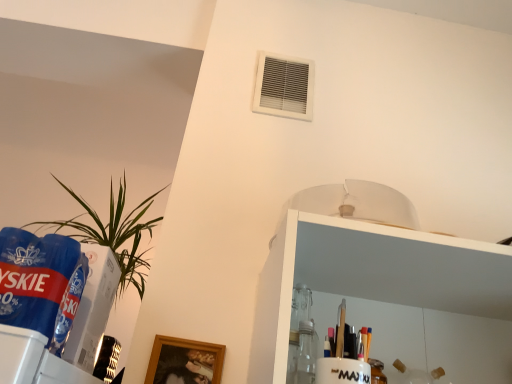
What is the approximate width of white plastic air conditioning at upper center?

white plastic air conditioning at upper center is 1.17 inches in width.

Locate an element on the screen. Image resolution: width=512 pixels, height=384 pixels. green leafy plant at left is located at coordinates (114, 233).

From the image's perspective, which one is positioned lower, green leafy plant at left or blue plastic beverage at left?

green leafy plant at left.

Is green leafy plant at left in contact with blue plastic beverage at left?

No, green leafy plant at left is not with blue plastic beverage at left.

From a real-world perspective, which is physically above, green leafy plant at left or blue plastic beverage at left?

green leafy plant at left is physically above.

Can we say green leafy plant at left lies outside blue plastic beverage at left?

Yes, green leafy plant at left is located beyond the bounds of blue plastic beverage at left.

Which object is positioned more to the left, blue plastic beverage at left or white plastic air conditioning at upper center?

From the viewer's perspective, blue plastic beverage at left appears more on the left side.

From a real-world perspective, is blue plastic beverage at left located beneath white plastic air conditioning at upper center?

Yes.

Is blue plastic beverage at left closer to camera compared to white plastic air conditioning at upper center?

Yes, it is.

Is blue plastic beverage at left turned away from white plastic air conditioning at upper center?

No, blue plastic beverage at left's orientation is not away from white plastic air conditioning at upper center.

Considering the relative sizes of blue plastic beverage at left and green leafy plant at left in the image provided, is blue plastic beverage at left smaller than green leafy plant at left?

Indeed, blue plastic beverage at left has a smaller size compared to green leafy plant at left.

From the image's perspective, is blue plastic beverage at left above green leafy plant at left?

Result: Correct, blue plastic beverage at left appears higher than green leafy plant at left in the image.

How distant is blue plastic beverage at left from green leafy plant at left?

blue plastic beverage at left and green leafy plant at left are 28.35 inches apart.

Who is taller, blue plastic beverage at left or green leafy plant at left?

green leafy plant at left.

Is green leafy plant at left at the right side of white plastic air conditioning at upper center?

Incorrect, green leafy plant at left is not on the right side of white plastic air conditioning at upper center.

Can you confirm if green leafy plant at left is taller than white plastic air conditioning at upper center?

Indeed, green leafy plant at left has a greater height compared to white plastic air conditioning at upper center.

From the image's perspective, is green leafy plant at left above or below white plastic air conditioning at upper center?

green leafy plant at left is situated lower than white plastic air conditioning at upper center in the image.

This screenshot has height=384, width=512. What are the coordinates of `air conditioning that appears on the right of blue plastic beverage at left` in the screenshot? It's located at (284, 87).

Can you tell me how much white plastic air conditioning at upper center and blue plastic beverage at left differ in facing direction?

2.51 degrees.

Is white plastic air conditioning at upper center looking in the opposite direction of blue plastic beverage at left?

That's not correct — white plastic air conditioning at upper center is not looking away from blue plastic beverage at left.

Which point is more forward, (289, 108) or (78, 290)?

The point (78, 290) is closer to the camera.

The image size is (512, 384). Find the location of `air conditioning located above the green leafy plant at left (from the image's perspective)`. air conditioning located above the green leafy plant at left (from the image's perspective) is located at coordinates (284, 87).

Would you say green leafy plant at left is part of white plastic air conditioning at upper center's contents?

No, green leafy plant at left is not surrounded by white plastic air conditioning at upper center.

How different are the orientations of white plastic air conditioning at upper center and green leafy plant at left in degrees?

The angle between the facing direction of white plastic air conditioning at upper center and the facing direction of green leafy plant at left is 177 degrees.

Identify the location of beverage to the right of green leafy plant at left. This screenshot has width=512, height=384. (40, 282).

At what (x,y) coordinates should I click in order to perform the action: click on beverage lying below the white plastic air conditioning at upper center (from the image's perspective). Please return your answer as a coordinate pair (x, y). Looking at the image, I should click on (40, 282).

Looking at the image, which one is located further to blue plastic beverage at left, white plastic air conditioning at upper center or green leafy plant at left?

white plastic air conditioning at upper center lies further to blue plastic beverage at left than the other object.

Based on their spatial positions, is green leafy plant at left or white plastic air conditioning at upper center closer to blue plastic beverage at left?

green leafy plant at left is closer to blue plastic beverage at left.

In the scene shown: Looking at the image, which one is located closer to green leafy plant at left, blue plastic beverage at left or white plastic air conditioning at upper center?

The object closer to green leafy plant at left is white plastic air conditioning at upper center.

Which object lies nearer to the anchor point green leafy plant at left, white plastic air conditioning at upper center or blue plastic beverage at left?

white plastic air conditioning at upper center is positioned closer to the anchor green leafy plant at left.

Considering their positions, is blue plastic beverage at left positioned closer to white plastic air conditioning at upper center than green leafy plant at left?

Among the two, green leafy plant at left is located nearer to white plastic air conditioning at upper center.

Considering their positions, is green leafy plant at left positioned further to white plastic air conditioning at upper center than blue plastic beverage at left?

blue plastic beverage at left lies further to white plastic air conditioning at upper center than the other object.

Locate an element on the screen. This screenshot has width=512, height=384. houseplant between blue plastic beverage at left and white plastic air conditioning at upper center in the front-back direction is located at coordinates (114, 233).